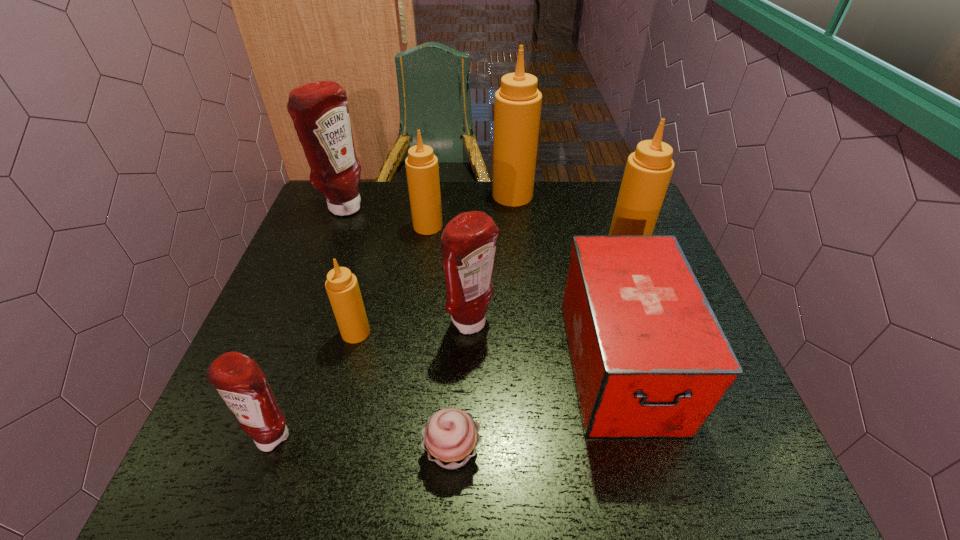
At what (x,y) coordinates should I click in order to perform the action: click on free space that satisfies the following two spatial constraints: 1. on the back side of the tallest condiment; 2. on the right side of the smallest red condiment. Please return your answer as a coordinate pair (x, y). The image size is (960, 540). Looking at the image, I should click on (359, 195).

Identify the location of vacant space that satisfies the following two spatial constraints: 1. on the back side of the rightmost condiment; 2. on the left side of the shortest object. This screenshot has height=540, width=960. (462, 248).